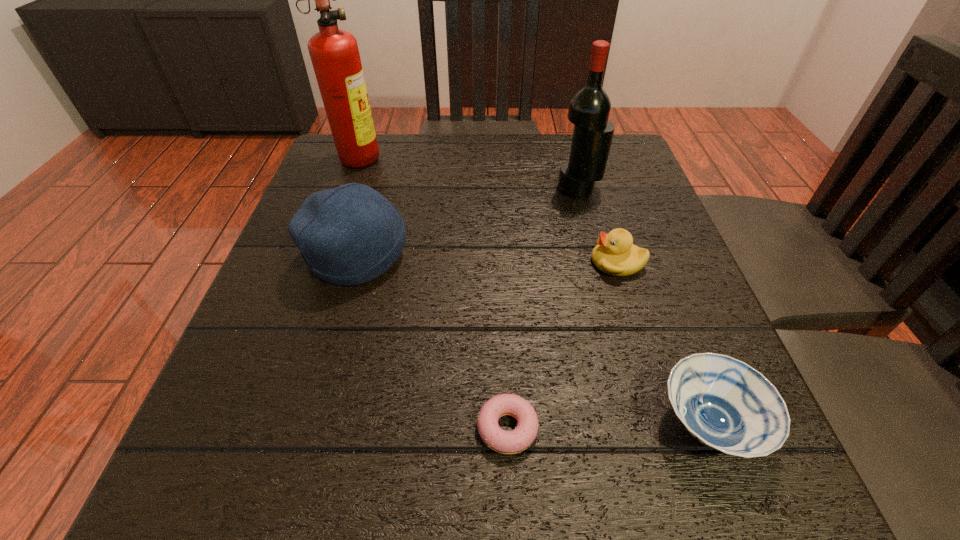
You are a GUI agent. You are given a task and a screenshot of the screen. Output one action in this format:
    pyautogui.click(x=<x>, y=<y>)
    Task: Click on the vacant space that satisfies the following two spatial constraints: 1. on the front-facing side of the third tallest object; 2. on the left side of the farthest object
    The image size is (960, 540).
    Given the screenshot: What is the action you would take?
    pyautogui.click(x=324, y=254)

The width and height of the screenshot is (960, 540). I want to click on free space in the image that satisfies the following two spatial constraints: 1. on the front-facing side of the tallest object; 2. on the right side of the doughnut, so click(262, 428).

Where is `vacant space that satisfies the following two spatial constraints: 1. on the back side of the second tallest object; 2. on the front-facing side of the fire extinguisher`? vacant space that satisfies the following two spatial constraints: 1. on the back side of the second tallest object; 2. on the front-facing side of the fire extinguisher is located at coordinates (570, 156).

Locate an element on the screen. The height and width of the screenshot is (540, 960). vacant space that satisfies the following two spatial constraints: 1. on the front-facing side of the farthest object; 2. on the left side of the shortest object is located at coordinates (262, 428).

Identify the location of free space that satisfies the following two spatial constraints: 1. on the front-facing side of the tallest object; 2. on the left side of the wine bottle. The width and height of the screenshot is (960, 540). (348, 188).

You are a GUI agent. You are given a task and a screenshot of the screen. Output one action in this format:
    pyautogui.click(x=<x>, y=<y>)
    Task: Click on the vacant space that satisfies the following two spatial constraints: 1. on the back side of the fourth object from right to left; 2. on the left side of the fifth shortest object
    
    Given the screenshot: What is the action you would take?
    pyautogui.click(x=496, y=188)

Locate an element on the screen. free region that satisfies the following two spatial constraints: 1. at the face of the soup bowl; 2. on the left side of the duckling is located at coordinates (667, 424).